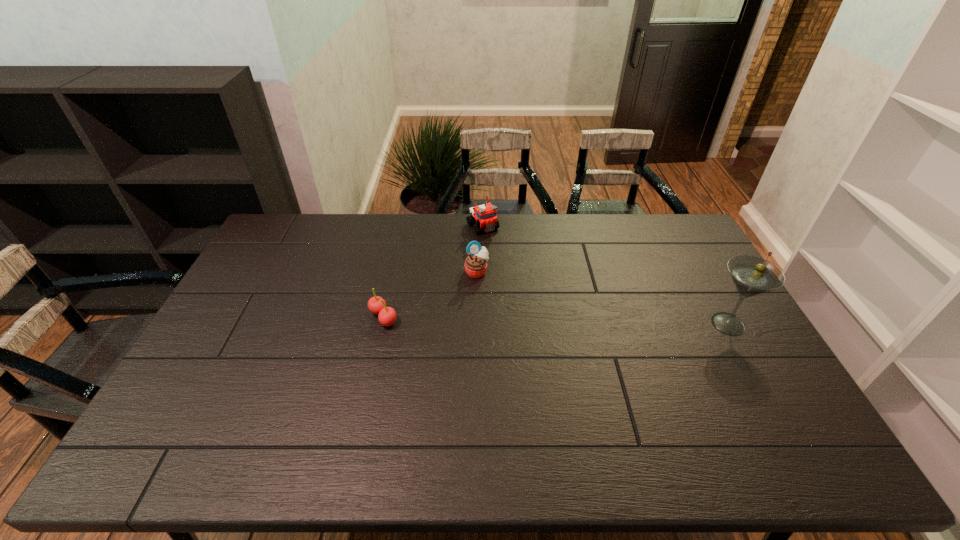
Locate an element on the screen. The height and width of the screenshot is (540, 960). the shortest object is located at coordinates (387, 316).

You are a GUI agent. You are given a task and a screenshot of the screen. Output one action in this format:
    pyautogui.click(x=<x>, y=<y>)
    Task: Click on the leftmost object
    The width and height of the screenshot is (960, 540).
    Given the screenshot: What is the action you would take?
    click(x=387, y=316)

Where is `martini`? Image resolution: width=960 pixels, height=540 pixels. martini is located at coordinates (751, 275).

You are a GUI agent. You are given a task and a screenshot of the screen. Output one action in this format:
    pyautogui.click(x=<x>, y=<y>)
    Task: Click on the tallest object
    The image size is (960, 540).
    Given the screenshot: What is the action you would take?
    pyautogui.click(x=751, y=275)

Where is `muffin`? The height and width of the screenshot is (540, 960). muffin is located at coordinates (475, 264).

Where is `the farthest object`? The image size is (960, 540). the farthest object is located at coordinates (485, 215).

What are the coordinates of `free spot located 0.050m on the left of the cherry` in the screenshot? It's located at (351, 318).

Identify the location of vacant space situated on the front of the tallest object. (750, 362).

Locate an element on the screen. The image size is (960, 540). free space located 0.100m on the front-facing side of the muffin is located at coordinates (505, 293).

Locate an element on the screen. vacant area located 0.310m on the front-facing side of the muffin is located at coordinates tap(553, 329).